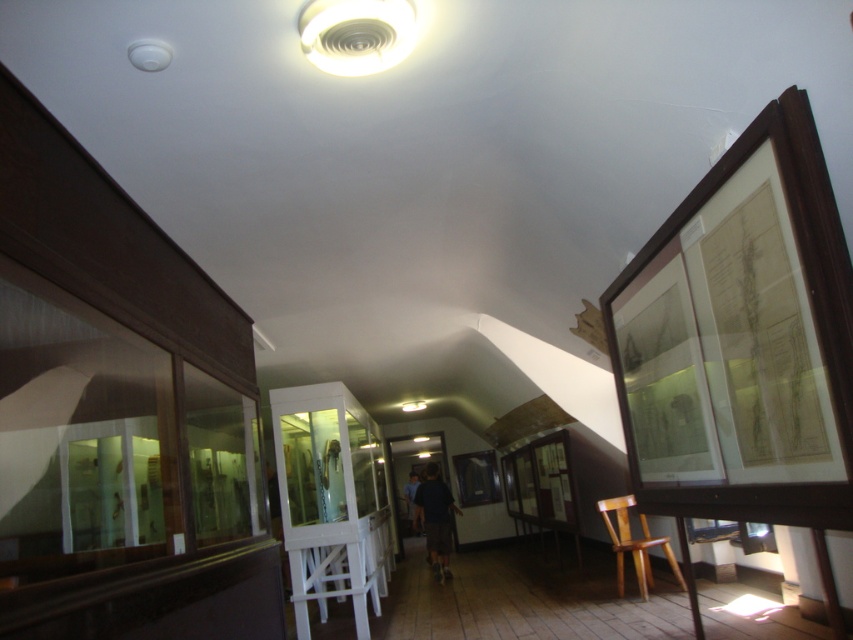
Question: Which object is closer to the camera taking this photo?

Choices:
 (A) white plastic ceiling fan at upper center
 (B) dark blue shirt at center
 (C) wooden chair at lower right

Answer: (A)

Question: Does white plastic ceiling fan at upper center have a smaller size compared to dark blue shirt at center?

Choices:
 (A) no
 (B) yes

Answer: (B)

Question: Which point appears farthest from the camera in this image?

Choices:
 (A) (425, 474)
 (B) (643, 516)
 (C) (370, 33)

Answer: (A)

Question: From the image, what is the correct spatial relationship of white plastic ceiling fan at upper center in relation to dark blue shirt at center?

Choices:
 (A) right
 (B) left

Answer: (B)

Question: Among these points, which one is nearest to the camera?

Choices:
 (A) (396, 48)
 (B) (448, 544)

Answer: (A)

Question: In this image, where is wooden chair at lower right located relative to dark blue shirt at center?

Choices:
 (A) below
 (B) above

Answer: (B)